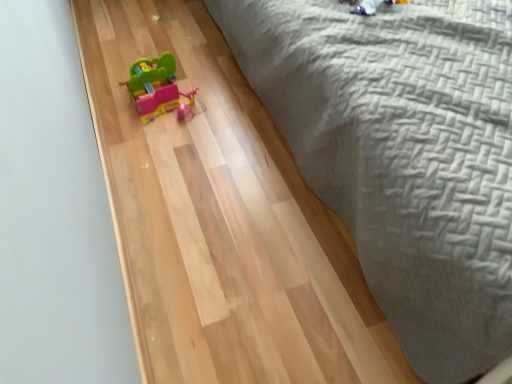
Question: Is point (166, 61) closer or farther from the camera than point (418, 347)?

Choices:
 (A) farther
 (B) closer

Answer: (A)

Question: Is matte plastic toy car at center inside the boundaries of gray woven bedspread at upper right, or outside?

Choices:
 (A) outside
 (B) inside

Answer: (A)

Question: In terms of height, does matte plastic toy car at center look taller or shorter compared to gray woven bedspread at upper right?

Choices:
 (A) short
 (B) tall

Answer: (A)

Question: From a real-world perspective, relative to matte plastic toy car at center, is gray woven bedspread at upper right vertically above or below?

Choices:
 (A) above
 (B) below

Answer: (A)

Question: In the image, is gray woven bedspread at upper right positioned in front of or behind matte plastic toy car at center?

Choices:
 (A) front
 (B) behind

Answer: (A)

Question: Is gray woven bedspread at upper right wider or thinner than matte plastic toy car at center?

Choices:
 (A) thin
 (B) wide

Answer: (B)

Question: From the image's perspective, is gray woven bedspread at upper right positioned above or below matte plastic toy car at center?

Choices:
 (A) below
 (B) above

Answer: (B)